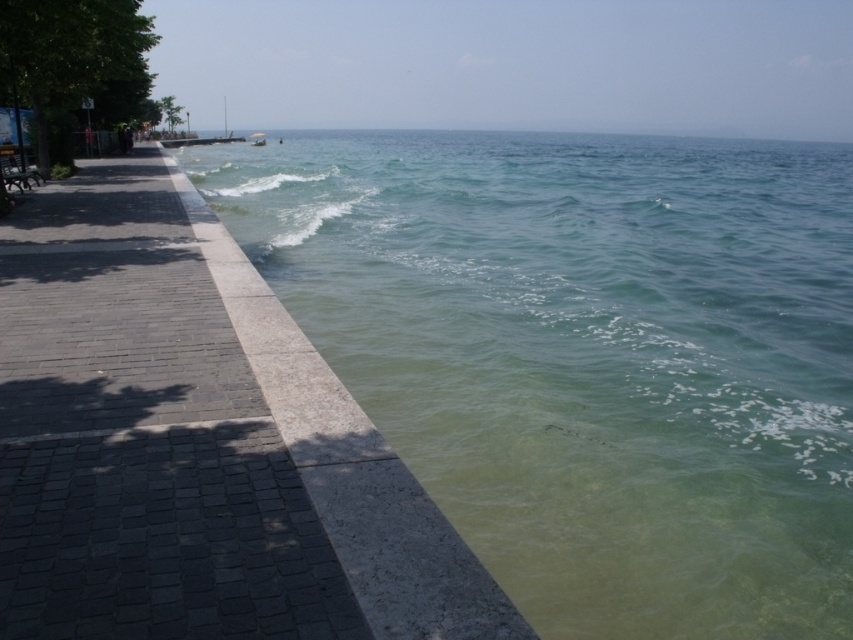
Is dark gray stone pavement at left positioned at the back of white plastic boat at center?

No, dark gray stone pavement at left is closer to the viewer.

Based on the photo, who is more distant from viewer, [222,609] or [256,138]?

Positioned behind is point [256,138].

Describe the element at coordinates (141, 435) in the screenshot. I see `dark gray stone pavement at left` at that location.

Where is `dark gray stone pavement at left`? The width and height of the screenshot is (853, 640). dark gray stone pavement at left is located at coordinates (141, 435).

Looking at this image, which is more to the left, clear water at lower right or dark gray stone pavement at left?

dark gray stone pavement at left is more to the left.

Which of these two, clear water at lower right or dark gray stone pavement at left, stands taller?

Standing taller between the two is clear water at lower right.

Locate an element on the screen. This screenshot has width=853, height=640. clear water at lower right is located at coordinates (589, 355).

Find the location of a particular element. The image size is (853, 640). clear water at lower right is located at coordinates (589, 355).

Who is shorter, clear water at lower right or white plastic boat at center?

Standing shorter between the two is clear water at lower right.

Can you confirm if clear water at lower right is positioned above white plastic boat at center?

No.

Identify the location of clear water at lower right. The image size is (853, 640). (589, 355).